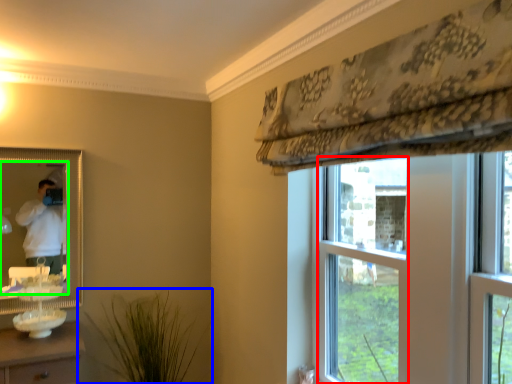
Question: Estimate the real-world distances between objects in this image. Which object is closer to bay window (highlighted by a red box), houseplant (highlighted by a blue box) or mirror (highlighted by a green box)?

Choices:
 (A) houseplant
 (B) mirror

Answer: (A)